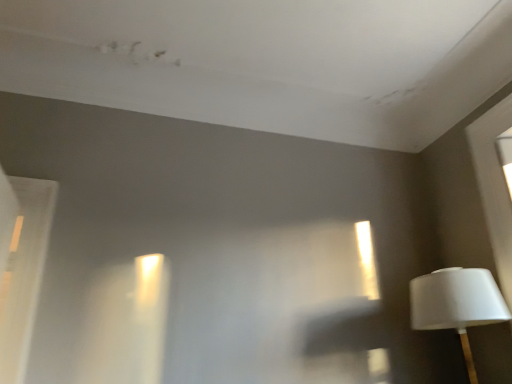
Question: Considering the relative sizes of white glossy door at left and white matte lampshade at right in the image provided, is white glossy door at left shorter than white matte lampshade at right?

Choices:
 (A) yes
 (B) no

Answer: (B)

Question: Does white glossy door at left lie in front of white matte lampshade at right?

Choices:
 (A) yes
 (B) no

Answer: (A)

Question: Can we say white glossy door at left lies outside white matte lampshade at right?

Choices:
 (A) yes
 (B) no

Answer: (A)

Question: Is white glossy door at left behind white matte lampshade at right?

Choices:
 (A) no
 (B) yes

Answer: (A)

Question: Can you confirm if white glossy door at left is thinner than white matte lampshade at right?

Choices:
 (A) yes
 (B) no

Answer: (A)

Question: Is white glossy door at left facing away from white matte lampshade at right?

Choices:
 (A) yes
 (B) no

Answer: (A)

Question: From the image's perspective, does white matte lampshade at right appear lower than white glossy door at left?

Choices:
 (A) no
 (B) yes

Answer: (B)

Question: Is white matte lampshade at right oriented away from white glossy door at left?

Choices:
 (A) no
 (B) yes

Answer: (A)

Question: Is white matte lampshade at right to the right of white glossy door at left from the viewer's perspective?

Choices:
 (A) no
 (B) yes

Answer: (B)

Question: Can you confirm if white matte lampshade at right is thinner than white glossy door at left?

Choices:
 (A) yes
 (B) no

Answer: (B)

Question: From a real-world perspective, is white matte lampshade at right on top of white glossy door at left?

Choices:
 (A) yes
 (B) no

Answer: (B)

Question: Is white matte lampshade at right not near white glossy door at left?

Choices:
 (A) yes
 (B) no

Answer: (A)

Question: From a real-world perspective, is white glossy door at left above or below white matte lampshade at right?

Choices:
 (A) above
 (B) below

Answer: (A)